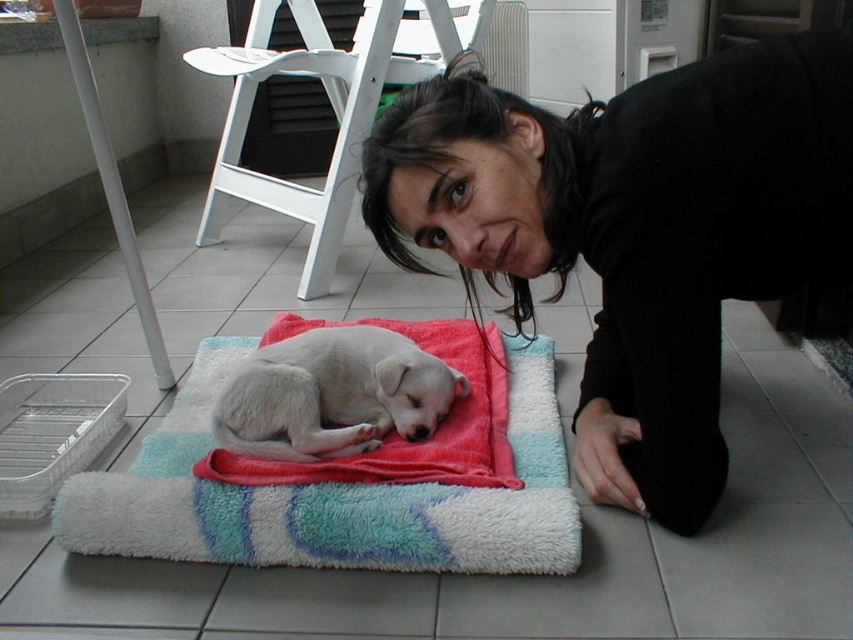
Question: Considering the real-world distances, which object is farthest from the black fabric at center?

Choices:
 (A) soft multicolored rug at center
 (B) white fluffy dog at center

Answer: (A)

Question: Can you confirm if soft multicolored rug at center is thinner than white fluffy dog at center?

Choices:
 (A) no
 (B) yes

Answer: (A)

Question: Is black fabric at center in front of white fluffy dog at center?

Choices:
 (A) yes
 (B) no

Answer: (A)

Question: Which point is farther to the camera?

Choices:
 (A) (746, 150)
 (B) (497, 410)
 (C) (409, 346)

Answer: (B)

Question: Which of the following is the closest to the observer?

Choices:
 (A) (540, 168)
 (B) (299, 392)
 (C) (496, 397)

Answer: (A)

Question: Is black fabric at center positioned behind white fluffy dog at center?

Choices:
 (A) yes
 (B) no

Answer: (B)